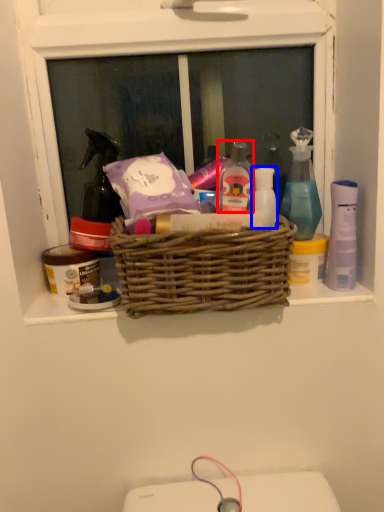
Question: Which of the following is the farthest to the observer, toiletry (highlighted by a red box) or toiletry (highlighted by a blue box)?

Choices:
 (A) toiletry
 (B) toiletry

Answer: (B)